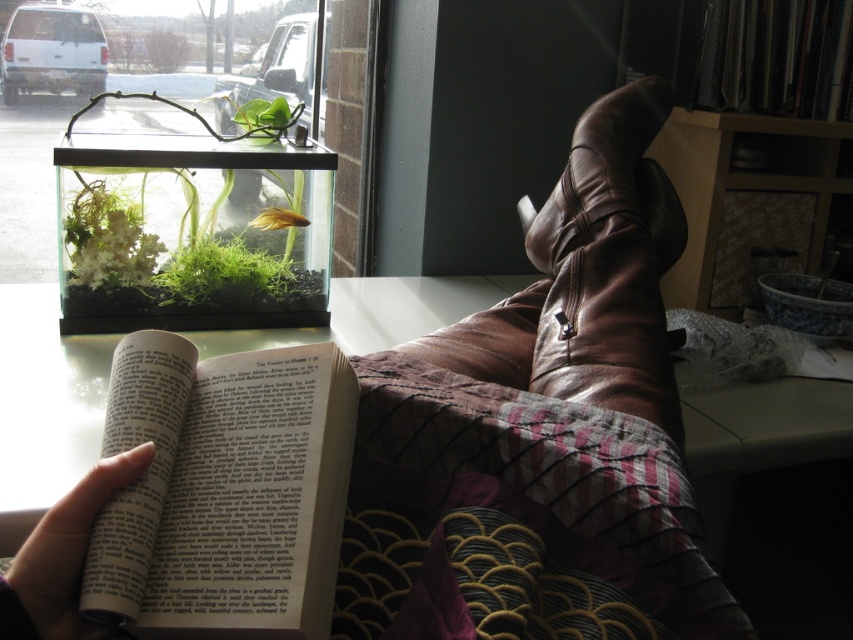
Question: Does paperback book at center appear on the left side of green mossy plant at upper left?

Choices:
 (A) yes
 (B) no

Answer: (B)

Question: Which object appears closest to the camera in this image?

Choices:
 (A) paperback book at center
 (B) green mossy plant at upper left

Answer: (A)

Question: Which point is closer to the camera?

Choices:
 (A) (86, 148)
 (B) (260, 412)

Answer: (B)

Question: From the image, what is the correct spatial relationship of paperback book at center in relation to green mossy plant at upper left?

Choices:
 (A) right
 (B) left

Answer: (A)

Question: Is paperback book at center wider than green mossy plant at upper left?

Choices:
 (A) no
 (B) yes

Answer: (A)